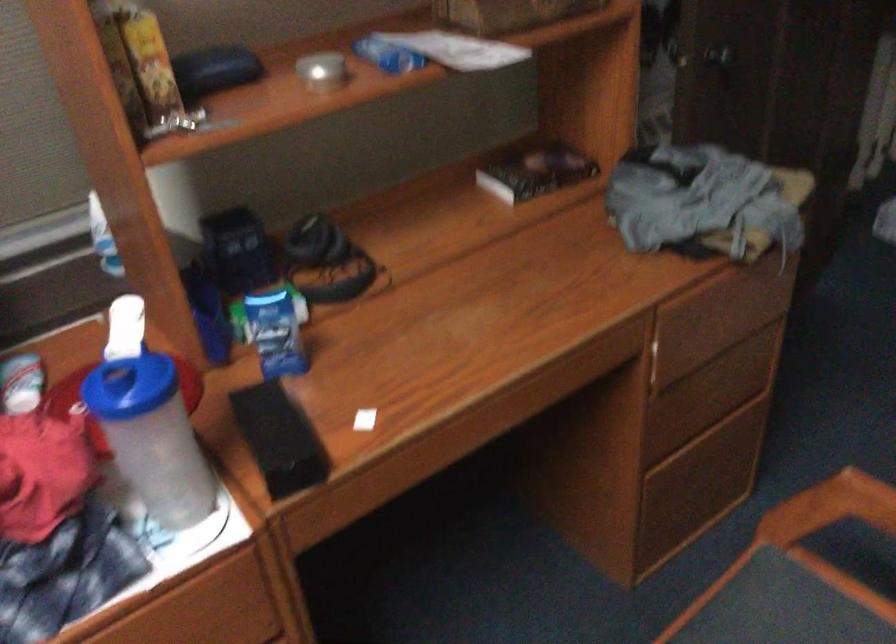
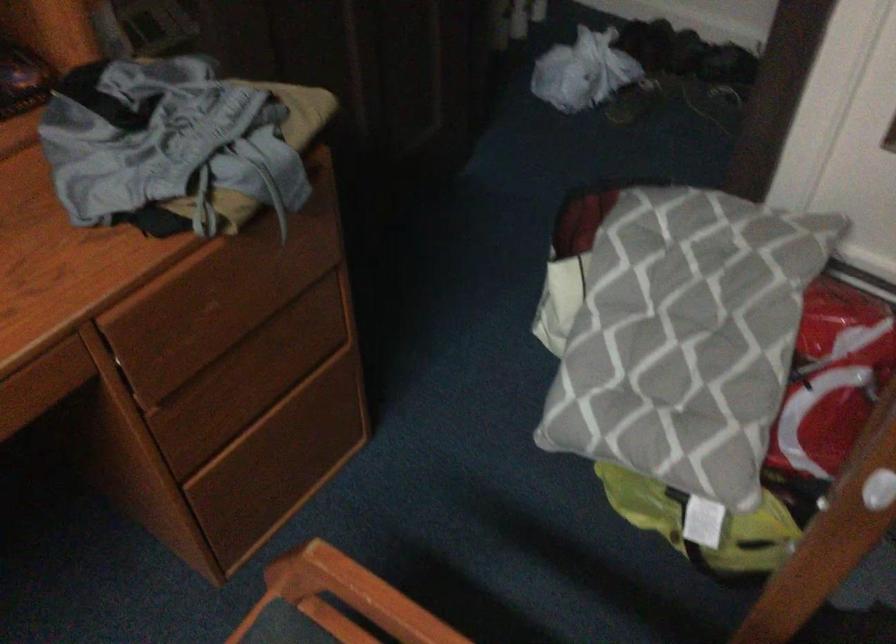
The point at (707, 305) is marked in the first image. Where is the corresponding point in the second image?

(196, 294)